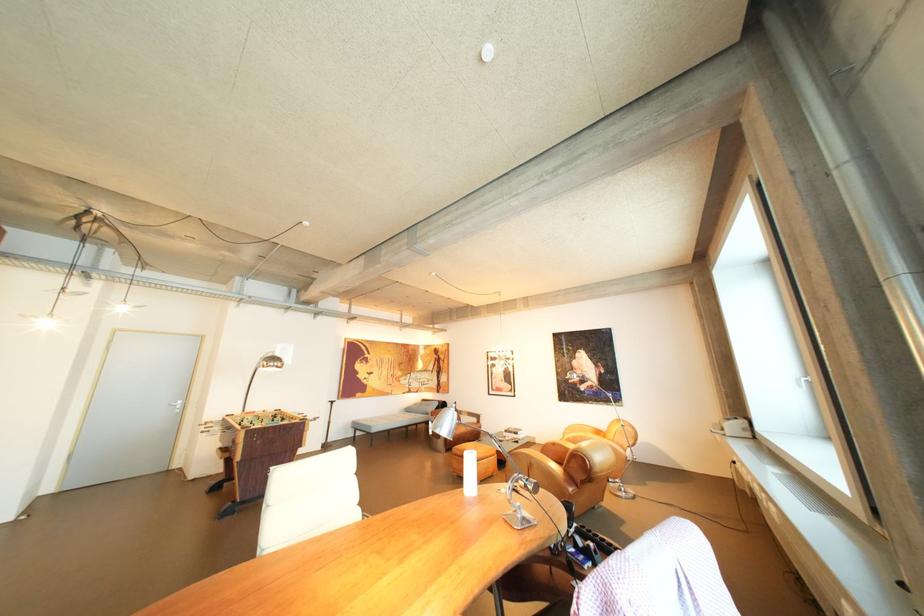
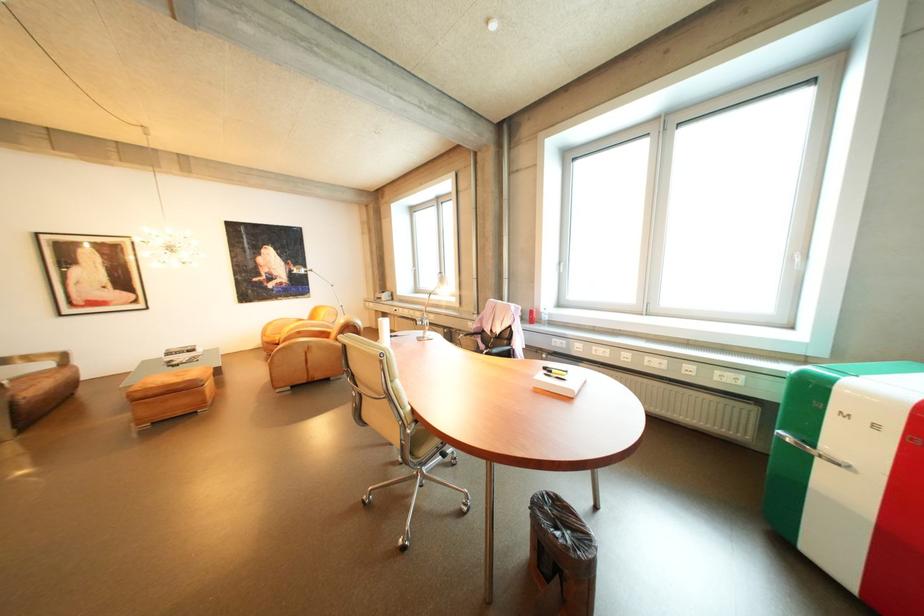
In the second image, find the point that corresponds to point 606,367 in the first image.

(296, 264)